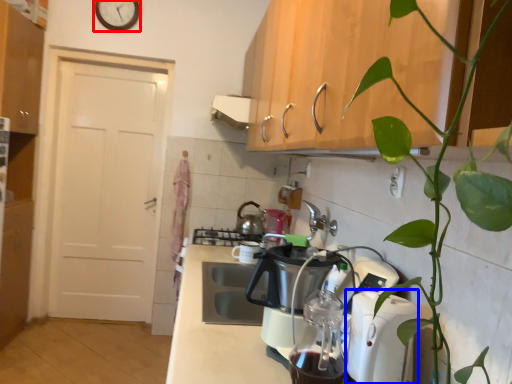
Question: Which of the following is the closest to the observer, clock (highlighted by a red box) or kitchen appliance (highlighted by a blue box)?

Choices:
 (A) clock
 (B) kitchen appliance

Answer: (B)